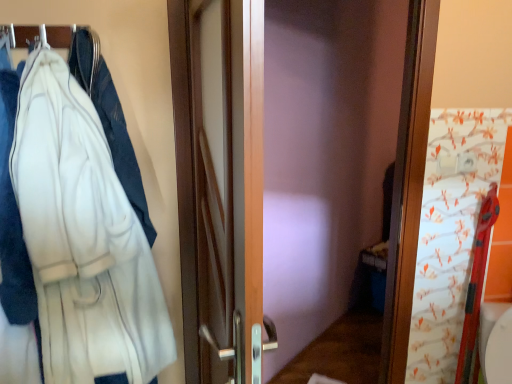
Question: From a real-world perspective, does white fleece jacket at left sit lower than white fleece bathrobe at left?

Choices:
 (A) no
 (B) yes

Answer: (A)

Question: Is white fleece jacket at left positioned with its back to white fleece bathrobe at left?

Choices:
 (A) yes
 (B) no

Answer: (A)

Question: From the image's perspective, is white fleece jacket at left above white fleece bathrobe at left?

Choices:
 (A) yes
 (B) no

Answer: (A)

Question: Considering the relative sizes of white fleece jacket at left and white fleece bathrobe at left in the image provided, is white fleece jacket at left taller than white fleece bathrobe at left?

Choices:
 (A) no
 (B) yes

Answer: (A)

Question: From the image's perspective, is white fleece jacket at left located beneath white fleece bathrobe at left?

Choices:
 (A) yes
 (B) no

Answer: (B)

Question: Is white fleece jacket at left next to white fleece bathrobe at left?

Choices:
 (A) yes
 (B) no

Answer: (B)

Question: Is white fleece bathrobe at left outside of white fleece jacket at left?

Choices:
 (A) yes
 (B) no

Answer: (A)

Question: Can you confirm if white fleece bathrobe at left is positioned to the right of white fleece jacket at left?

Choices:
 (A) yes
 (B) no

Answer: (A)

Question: From the image's perspective, is white fleece bathrobe at left beneath white fleece jacket at left?

Choices:
 (A) yes
 (B) no

Answer: (A)

Question: Is white fleece bathrobe at left far from white fleece jacket at left?

Choices:
 (A) no
 (B) yes

Answer: (A)

Question: Is white fleece bathrobe at left further to camera compared to white fleece jacket at left?

Choices:
 (A) yes
 (B) no

Answer: (B)

Question: Is white fleece bathrobe at left aimed at white fleece jacket at left?

Choices:
 (A) no
 (B) yes

Answer: (A)

Question: Does metallic silver hanger at upper left turn towards white fleece bathrobe at left?

Choices:
 (A) no
 (B) yes

Answer: (B)